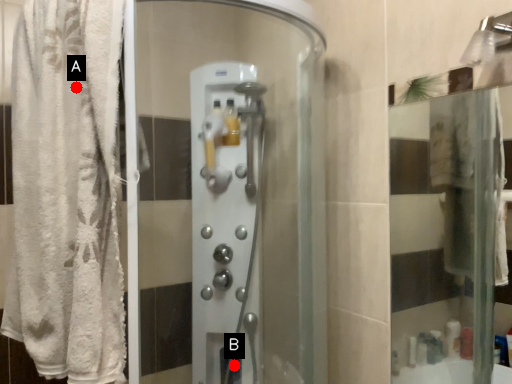
Question: Two points are circled on the image, labeled by A and B beside each circle. Which of the following is the closest to the observer?

Choices:
 (A) A is closer
 (B) B is closer

Answer: (A)